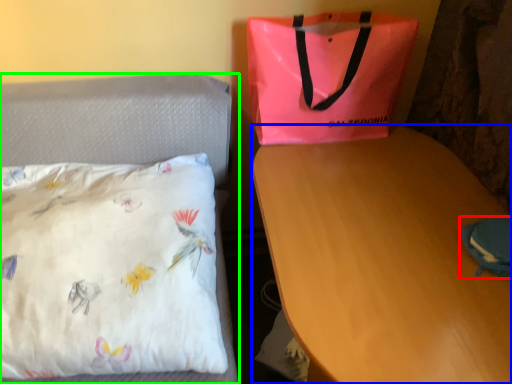
Question: Considering the real-world distances, which object is farthest from pouch (highlighted by a red box)? desk (highlighted by a blue box) or bed (highlighted by a green box)?

Choices:
 (A) desk
 (B) bed

Answer: (B)